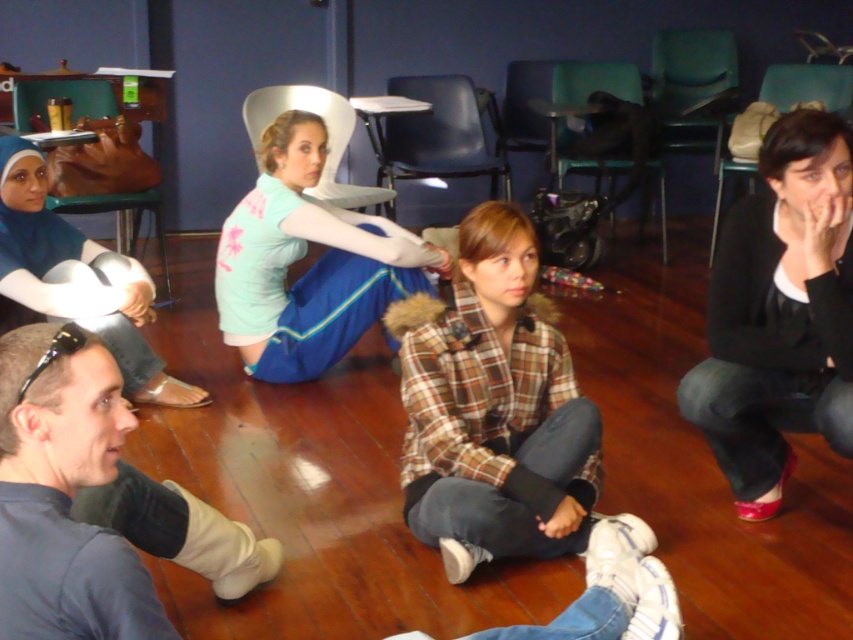
How distant is blue denim jeans at lower center from blue fabric hijab at upper left?

A distance of 6.13 feet exists between blue denim jeans at lower center and blue fabric hijab at upper left.

Who is more forward, (64, 436) or (3, 273)?

Point (64, 436)

I want to click on blue denim jeans at lower center, so click(x=64, y=493).

Is blue denim jeans at lower center smaller than light blue fabric skirt at center?

Yes.

Between blue denim jeans at lower center and light blue fabric skirt at center, which one has more height?

light blue fabric skirt at center is taller.

Locate an element on the screen. blue denim jeans at lower center is located at coordinates pyautogui.click(x=64, y=493).

Locate an element on the screen. blue denim jeans at lower center is located at coordinates (64, 493).

Which of these two, black matte sweater at lower right or blue fabric hijab at upper left, stands taller?

With more height is black matte sweater at lower right.

Who is more distant from viewer, (827, 129) or (36, 300)?

Point (36, 300)

At what (x,y) coordinates should I click in order to perform the action: click on black matte sweater at lower right. Please return your answer as a coordinate pair (x, y). This screenshot has height=640, width=853. Looking at the image, I should click on (780, 314).